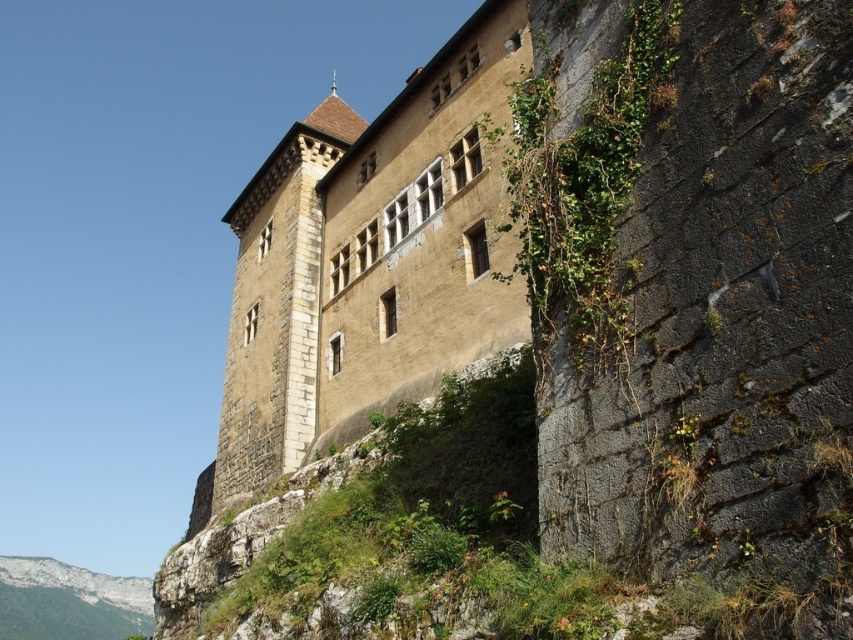
Is point (431, 301) more distant than point (236, 388)?

No.

Is point (329, 403) less distant than point (267, 416)?

Yes.

The height and width of the screenshot is (640, 853). I want to click on brown stone castle at center, so click(370, 259).